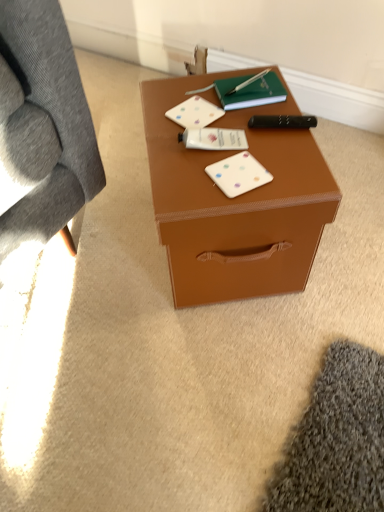
This screenshot has width=384, height=512. In order to click on empty space that is ontop of brown matte box at center (from a real-world perspective) in this screenshot , I will do `click(222, 139)`.